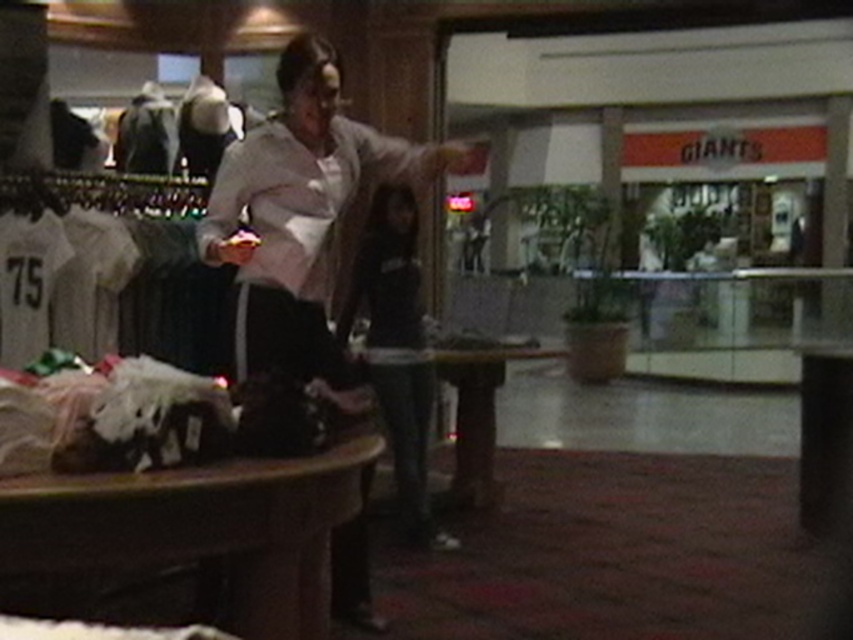
Question: Which point is closer to the camera?

Choices:
 (A) (396, 484)
 (B) (310, 289)

Answer: (B)

Question: Can you confirm if light pink fabric shirt at center is positioned below black matte jacket at center?

Choices:
 (A) yes
 (B) no

Answer: (B)

Question: From the image, what is the correct spatial relationship of light pink fabric shirt at center in relation to black matte jacket at center?

Choices:
 (A) left
 (B) right

Answer: (A)

Question: Can you confirm if light pink fabric shirt at center is bigger than black matte jacket at center?

Choices:
 (A) no
 (B) yes

Answer: (A)

Question: Which object appears farthest from the camera in this image?

Choices:
 (A) light pink fabric shirt at center
 (B) black matte jacket at center

Answer: (B)

Question: Which point is closer to the camera?

Choices:
 (A) light pink fabric shirt at center
 (B) black matte jacket at center

Answer: (A)